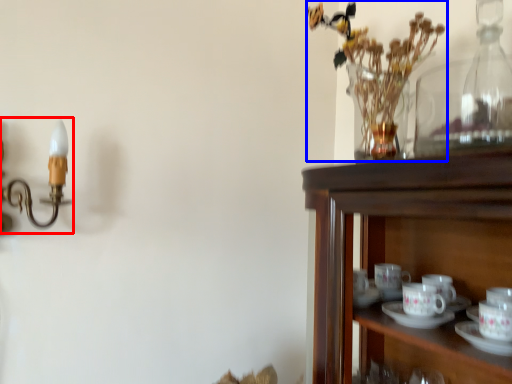
Question: Which of the following is the farthest to the observer, candle holder (highlighted by a red box) or floral arrangement (highlighted by a blue box)?

Choices:
 (A) candle holder
 (B) floral arrangement

Answer: (B)